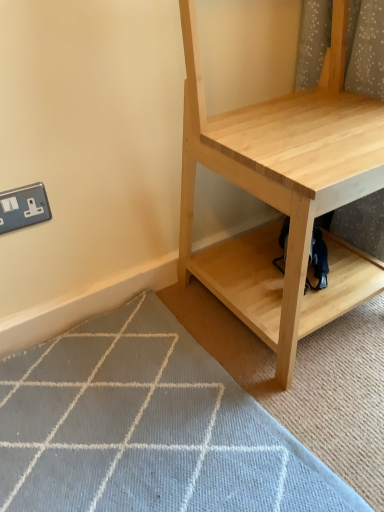
The height and width of the screenshot is (512, 384). What do you see at coordinates (283, 192) in the screenshot? I see `natural wood shelf at center` at bounding box center [283, 192].

I want to click on light gray woven mat at lower left, so click(x=146, y=428).

The height and width of the screenshot is (512, 384). What do you see at coordinates (318, 260) in the screenshot?
I see `dark blue fabric swivel chair at lower center` at bounding box center [318, 260].

Where is `natural wood shelf at center`? natural wood shelf at center is located at coordinates (283, 192).

From a real-world perspective, is natural wood shelf at center physically below silver metallic electric outlet at lower left?

No, from a real-world perspective, natural wood shelf at center is not beneath silver metallic electric outlet at lower left.

From the image's perspective, is natural wood shelf at center located above silver metallic electric outlet at lower left?

Yes, from the image's perspective, natural wood shelf at center is over silver metallic electric outlet at lower left.

Could you tell me if natural wood shelf at center is turned towards silver metallic electric outlet at lower left?

No, natural wood shelf at center is not oriented towards silver metallic electric outlet at lower left.

Considering the positions of objects natural wood shelf at center and silver metallic electric outlet at lower left in the image provided, who is behind, natural wood shelf at center or silver metallic electric outlet at lower left?

silver metallic electric outlet at lower left is further away from the camera.

Which of these two, natural wood shelf at center or light gray woven mat at lower left, is bigger?

With larger size is natural wood shelf at center.

Is natural wood shelf at center looking in the opposite direction of light gray woven mat at lower left?

natural wood shelf at center does not have its back to light gray woven mat at lower left.

Based on the photo, in terms of height, does natural wood shelf at center look taller or shorter compared to light gray woven mat at lower left?

natural wood shelf at center is taller than light gray woven mat at lower left.

Can you confirm if light gray woven mat at lower left is positioned to the right of dark blue fabric swivel chair at lower center?

In fact, light gray woven mat at lower left is to the left of dark blue fabric swivel chair at lower center.

In the scene shown: Are light gray woven mat at lower left and dark blue fabric swivel chair at lower center making contact?

light gray woven mat at lower left and dark blue fabric swivel chair at lower center are not in contact.

You are a GUI agent. You are given a task and a screenshot of the screen. Output one action in this format:
    pyautogui.click(x=<x>, y=<y>)
    Task: Click on the doormat that appears below the dark blue fabric swivel chair at lower center (from a real-world perspective)
    The height and width of the screenshot is (512, 384).
    Given the screenshot: What is the action you would take?
    pyautogui.click(x=146, y=428)

Is light gray woven mat at lower left facing towards dark blue fabric swivel chair at lower center?

No.

Is silver metallic electric outlet at lower left not near light gray woven mat at lower left?

silver metallic electric outlet at lower left is actually quite close to light gray woven mat at lower left.

From the image's perspective, is silver metallic electric outlet at lower left on light gray woven mat at lower left?

Yes.

Consider the image. How far apart are silver metallic electric outlet at lower left and light gray woven mat at lower left?

18.54 inches.

Do you think silver metallic electric outlet at lower left is within light gray woven mat at lower left, or outside of it?

silver metallic electric outlet at lower left cannot be found inside light gray woven mat at lower left.

Can you confirm if natural wood shelf at center is thinner than dark blue fabric swivel chair at lower center?

No.

Are natural wood shelf at center and dark blue fabric swivel chair at lower center making contact?

No, natural wood shelf at center is not with dark blue fabric swivel chair at lower center.

Is the depth of natural wood shelf at center less than that of dark blue fabric swivel chair at lower center?

Yes, natural wood shelf at center is closer to the camera.

Can dark blue fabric swivel chair at lower center be found inside natural wood shelf at center?

Yes, dark blue fabric swivel chair at lower center is inside natural wood shelf at center.

Based on the photo, would you say silver metallic electric outlet at lower left is part of dark blue fabric swivel chair at lower center's contents?

No, dark blue fabric swivel chair at lower center does not contain silver metallic electric outlet at lower left.

Is the position of dark blue fabric swivel chair at lower center less distant than that of silver metallic electric outlet at lower left?

No.

Based on their positions, is dark blue fabric swivel chair at lower center located to the left or right of silver metallic electric outlet at lower left?

From the image, it's evident that dark blue fabric swivel chair at lower center is to the right of silver metallic electric outlet at lower left.

Between point (285, 250) and point (12, 223), which one is positioned behind?

The point (285, 250) is behind.

Locate an element on the screen. This screenshot has height=512, width=384. swivel chair below the silver metallic electric outlet at lower left (from a real-world perspective) is located at coordinates (318, 260).

From the picture: Considering the relative sizes of silver metallic electric outlet at lower left and dark blue fabric swivel chair at lower center in the image provided, is silver metallic electric outlet at lower left wider than dark blue fabric swivel chair at lower center?

No.

From a real-world perspective, is silver metallic electric outlet at lower left positioned under dark blue fabric swivel chair at lower center based on gravity?

Incorrect, from a real-world perspective, silver metallic electric outlet at lower left is higher than dark blue fabric swivel chair at lower center.

From the image's perspective, is silver metallic electric outlet at lower left below dark blue fabric swivel chair at lower center?

Incorrect, from the image's perspective, silver metallic electric outlet at lower left is higher than dark blue fabric swivel chair at lower center.

Locate an element on the screen. electric outlet on the left of the natural wood shelf at center is located at coordinates (23, 207).

Find the location of a particular element. shelf lying above the light gray woven mat at lower left (from the image's perspective) is located at coordinates (283, 192).

Considering their positions, is light gray woven mat at lower left positioned further to silver metallic electric outlet at lower left than natural wood shelf at center?

Based on the image, natural wood shelf at center appears to be further to silver metallic electric outlet at lower left.

When comparing their distances from silver metallic electric outlet at lower left, does natural wood shelf at center or dark blue fabric swivel chair at lower center seem further?

dark blue fabric swivel chair at lower center.

Looking at the image, which one is located closer to light gray woven mat at lower left, silver metallic electric outlet at lower left or natural wood shelf at center?

The object closer to light gray woven mat at lower left is natural wood shelf at center.

Which object lies further to the anchor point light gray woven mat at lower left, natural wood shelf at center or dark blue fabric swivel chair at lower center?

dark blue fabric swivel chair at lower center is further to light gray woven mat at lower left.

Considering their positions, is light gray woven mat at lower left positioned closer to dark blue fabric swivel chair at lower center than natural wood shelf at center?

natural wood shelf at center is positioned closer to the anchor dark blue fabric swivel chair at lower center.

Which object lies further to the anchor point dark blue fabric swivel chair at lower center, silver metallic electric outlet at lower left or light gray woven mat at lower left?

Based on the image, silver metallic electric outlet at lower left appears to be further to dark blue fabric swivel chair at lower center.

Estimate the real-world distances between objects in this image. Which object is closer to light gray woven mat at lower left, dark blue fabric swivel chair at lower center or silver metallic electric outlet at lower left?

Among the two, dark blue fabric swivel chair at lower center is located nearer to light gray woven mat at lower left.

Considering their positions, is dark blue fabric swivel chair at lower center positioned further to light gray woven mat at lower left than natural wood shelf at center?

dark blue fabric swivel chair at lower center is further to light gray woven mat at lower left.

The height and width of the screenshot is (512, 384). Identify the location of doormat between natural wood shelf at center and dark blue fabric swivel chair at lower center from front to back. (146, 428).

You are a GUI agent. You are given a task and a screenshot of the screen. Output one action in this format:
    pyautogui.click(x=<x>, y=<y>)
    Task: Click on the doormat located between silver metallic electric outlet at lower left and natural wood shelf at center in the left-right direction
    
    Given the screenshot: What is the action you would take?
    pyautogui.click(x=146, y=428)

I want to click on doormat between silver metallic electric outlet at lower left and dark blue fabric swivel chair at lower center in the horizontal direction, so 146,428.

Where is `shelf between silver metallic electric outlet at lower left and dark blue fabric swivel chair at lower center from left to right`? The width and height of the screenshot is (384, 512). shelf between silver metallic electric outlet at lower left and dark blue fabric swivel chair at lower center from left to right is located at coordinates (283, 192).